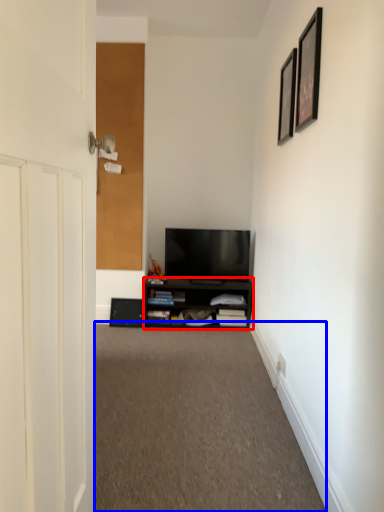
Question: Which of the following is the closest to the observer, cabinetry (highlighted by a red box) or plain (highlighted by a blue box)?

Choices:
 (A) cabinetry
 (B) plain

Answer: (B)